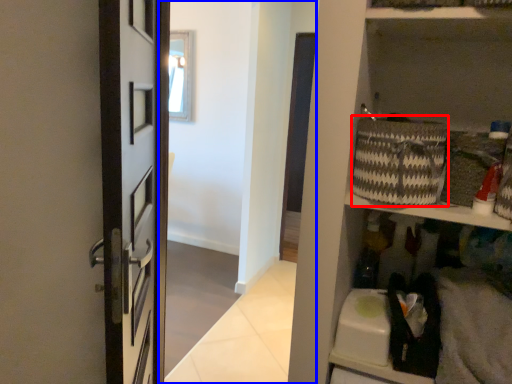
Question: Which of the following is the closest to the observer, basket (highlighted by a red box) or corridor (highlighted by a blue box)?

Choices:
 (A) basket
 (B) corridor

Answer: (A)